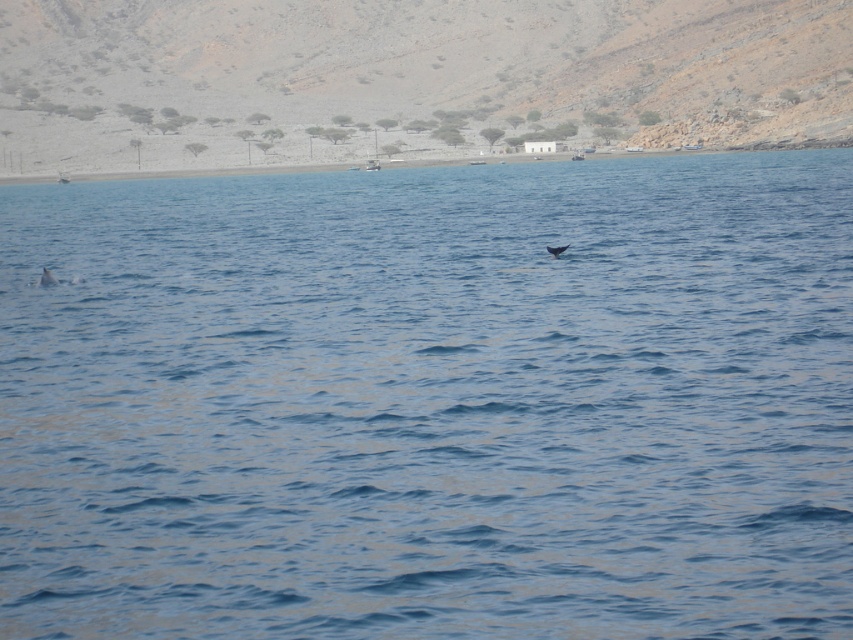
You are a marine biologist observing the dolphins in the coastal scene. You notice a dolphin at point (47, 278). Is this dolphin closer to the left or right side of the frame?

The light gray dolphin at left is located at point (47, 278), so it is closer to the left side of the frame.

You are a marine biologist observing the coastal scene. You notice the light gray dolphin at left and the gray matte whale at center. Which of these two marine animals takes up more visual space in the image?

The gray matte whale at center occupies more visual space than the light gray dolphin at left, as stated in the description.

You are a marine biologist observing the coastal scene. You notice the light gray dolphin at left and the gray matte whale at center. Which of these two marine animals has a smaller body width according to your observation?

The light gray dolphin at left has a smaller body width than the gray matte whale at center.